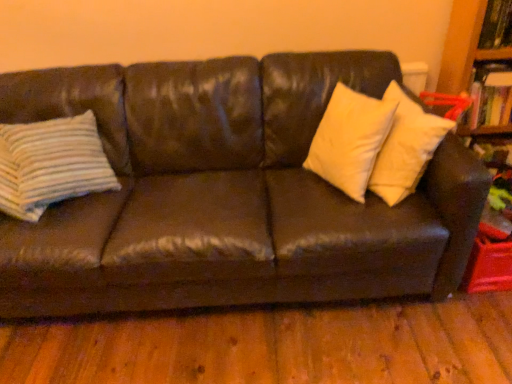
Question: Is hardcover book at upper right further to camera compared to striped fabric pillow at left, placed as the first pillow when sorted from left to right?

Choices:
 (A) no
 (B) yes

Answer: (B)

Question: Is hardcover book at upper right to the left of striped fabric pillow at left, the second pillow in the right-to-left sequence, from the viewer's perspective?

Choices:
 (A) yes
 (B) no

Answer: (B)

Question: Is hardcover book at upper right not near striped fabric pillow at left, the second pillow in the right-to-left sequence?

Choices:
 (A) yes
 (B) no

Answer: (A)

Question: Can you confirm if hardcover book at upper right is bigger than striped fabric pillow at left, placed as the first pillow when sorted from left to right?

Choices:
 (A) no
 (B) yes

Answer: (A)

Question: Does hardcover book at upper right have a greater width compared to striped fabric pillow at left, placed as the first pillow when sorted from left to right?

Choices:
 (A) yes
 (B) no

Answer: (B)

Question: Does hardcover book at upper right have a lesser height compared to striped fabric pillow at left, the second pillow in the right-to-left sequence?

Choices:
 (A) no
 (B) yes

Answer: (B)

Question: Considering the relative positions of white matte pillow at upper right, which is the first pillow in right-to-left order, and wooden bookcase at upper right in the image provided, is white matte pillow at upper right, which is the first pillow in right-to-left order, behind wooden bookcase at upper right?

Choices:
 (A) yes
 (B) no

Answer: (B)

Question: Is white matte pillow at upper right, which is the first pillow in right-to-left order, next to wooden bookcase at upper right?

Choices:
 (A) yes
 (B) no

Answer: (B)

Question: From the image's perspective, is white matte pillow at upper right, which is the first pillow in right-to-left order, above wooden bookcase at upper right?

Choices:
 (A) no
 (B) yes

Answer: (A)

Question: Could you tell me if white matte pillow at upper right, marked as the second pillow in a left-to-right arrangement, is facing wooden bookcase at upper right?

Choices:
 (A) no
 (B) yes

Answer: (A)

Question: From the image's perspective, is white matte pillow at upper right, which is the first pillow in right-to-left order, beneath wooden bookcase at upper right?

Choices:
 (A) yes
 (B) no

Answer: (A)

Question: From a real-world perspective, is white matte pillow at upper right, marked as the second pillow in a left-to-right arrangement, below wooden bookcase at upper right?

Choices:
 (A) no
 (B) yes

Answer: (A)

Question: From the image's perspective, does striped fabric pillow at left, placed as the first pillow when sorted from left to right, appear lower than wooden bookcase at upper right?

Choices:
 (A) no
 (B) yes

Answer: (B)